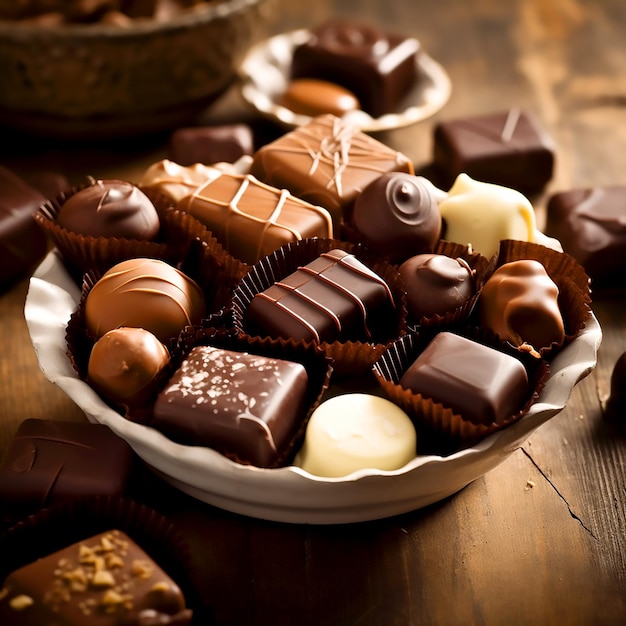
Image resolution: width=626 pixels, height=626 pixels. I want to click on bronze bowl, so click(101, 69).